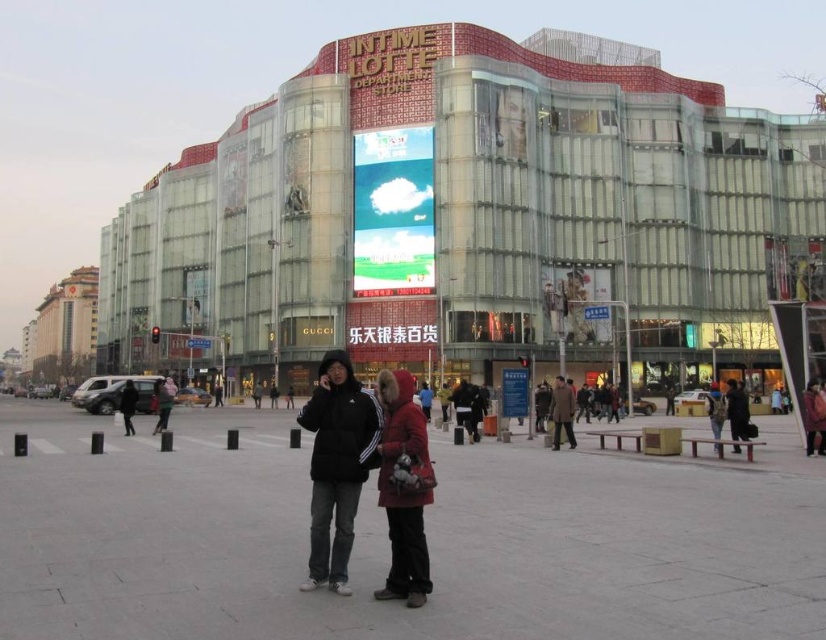
Question: Which point is closer to the camera?

Choices:
 (A) (131, 401)
 (B) (409, 577)

Answer: (B)

Question: Which object is positioned farthest from the smooth concrete plaza at center?

Choices:
 (A) dark gray jacket at center
 (B) brown wool coat at center
 (C) dark gray hoodie at center
 (D) red fur-lined coat at center

Answer: (C)

Question: Is red fur-lined coat at center thinner than black matte jacket at center?

Choices:
 (A) no
 (B) yes

Answer: (B)

Question: Can you confirm if smooth concrete plaza at center is smaller than red fur-lined coat at center?

Choices:
 (A) yes
 (B) no

Answer: (B)

Question: Is smooth concrete plaza at center positioned at the back of black matte jacket at center?

Choices:
 (A) yes
 (B) no

Answer: (B)

Question: Estimate the real-world distances between objects in this image. Which object is closer to the brown wool coat at center?

Choices:
 (A) dark gray jacket at center
 (B) dark gray hoodie at center
 (C) black matte jacket at center

Answer: (A)